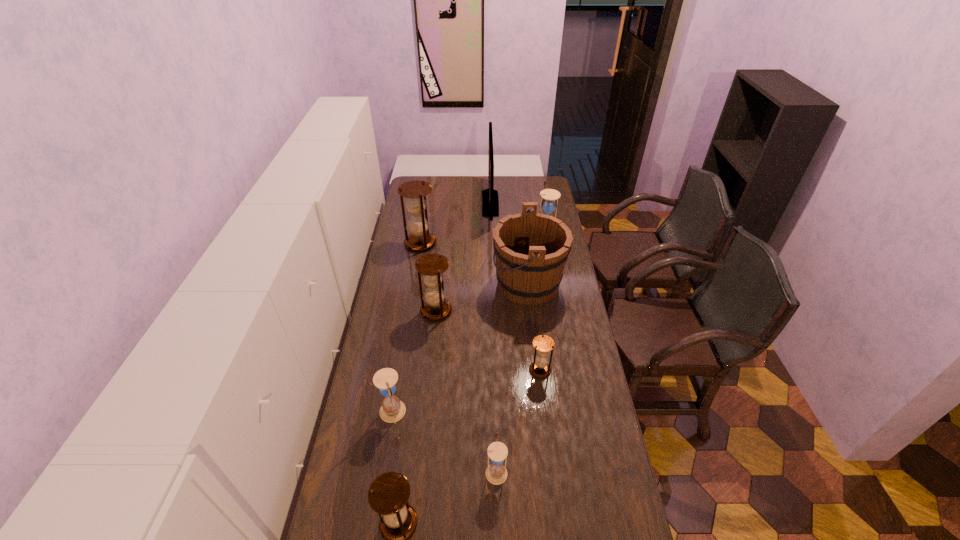
You are a GUI agent. You are given a task and a screenshot of the screen. Output one action in this format:
    pyautogui.click(x=<x>, y=<y>)
    Task: Click on the vacant area situated on the back of the farthest brown hourglass
    
    Given the screenshot: What is the action you would take?
    pyautogui.click(x=426, y=209)

The width and height of the screenshot is (960, 540). Find the location of `free region located on the front of the third smallest brown hourglass`. free region located on the front of the third smallest brown hourglass is located at coordinates (427, 401).

In order to click on vacant space located on the back of the biggest white hourglass in this screenshot , I will do `click(542, 217)`.

Locate an element on the screen. blank space located on the back of the second biggest white hourglass is located at coordinates (400, 354).

Locate an element on the screen. The image size is (960, 540). free region located 0.080m on the right of the third hourglass from right to left is located at coordinates (533, 471).

In order to click on free space located 0.380m on the back of the second nearest brown hourglass in this screenshot , I will do `click(530, 292)`.

Find the location of a particular element. The image size is (960, 540). object that is at the far edge is located at coordinates (490, 202).

Locate an element on the screen. Image resolution: width=960 pixels, height=540 pixels. wine bucket at the right edge is located at coordinates (531, 249).

Locate an element on the screen. vacant space at the far edge of the desktop is located at coordinates point(518,177).

Find the location of a particular element. vacant space at the right edge of the desktop is located at coordinates (588, 352).